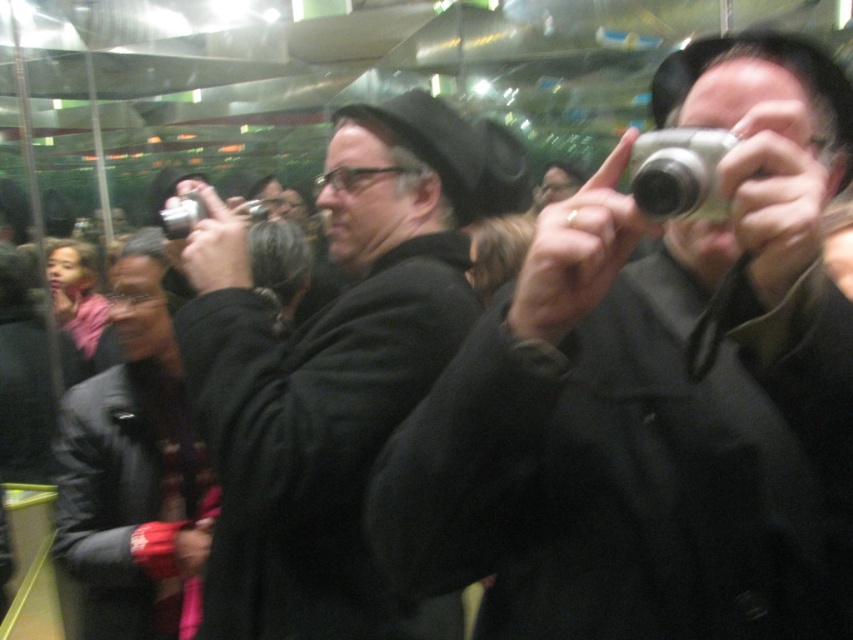
Question: Can you confirm if silver metallic camera at center is positioned below silver metallic camera at upper right?

Choices:
 (A) yes
 (B) no

Answer: (A)

Question: In this image, where is black matte coat at center located relative to silver metallic camera at upper center?

Choices:
 (A) left
 (B) right

Answer: (B)

Question: Based on their relative distances, which object is nearer to the black leather jacket at center?

Choices:
 (A) black matte coat at center
 (B) silver metallic camera at center
 (C) silver metallic camera at upper center
 (D) silver metallic camera at upper right

Answer: (A)

Question: Among these points, which one is nearest to the camera?

Choices:
 (A) (540, 429)
 (B) (404, 125)

Answer: (A)

Question: Is black leather jacket at center behind silver metallic camera at upper center?

Choices:
 (A) yes
 (B) no

Answer: (A)

Question: Which of the following is the farthest from the observer?

Choices:
 (A) silver metallic camera at center
 (B) silver metallic camera at upper right
 (C) black leather jacket at center
 (D) black matte coat at center

Answer: (C)